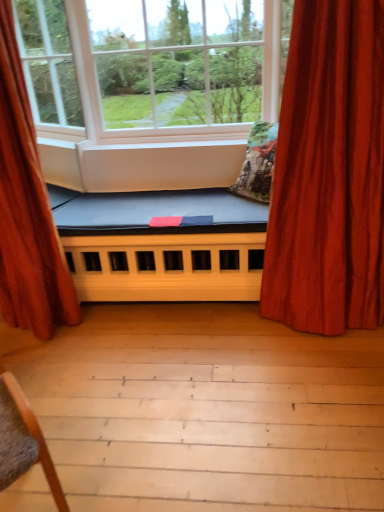
Locate an element on the screen. The height and width of the screenshot is (512, 384). free space above blue fabric futon at center (from a real-world perspective) is located at coordinates (155, 208).